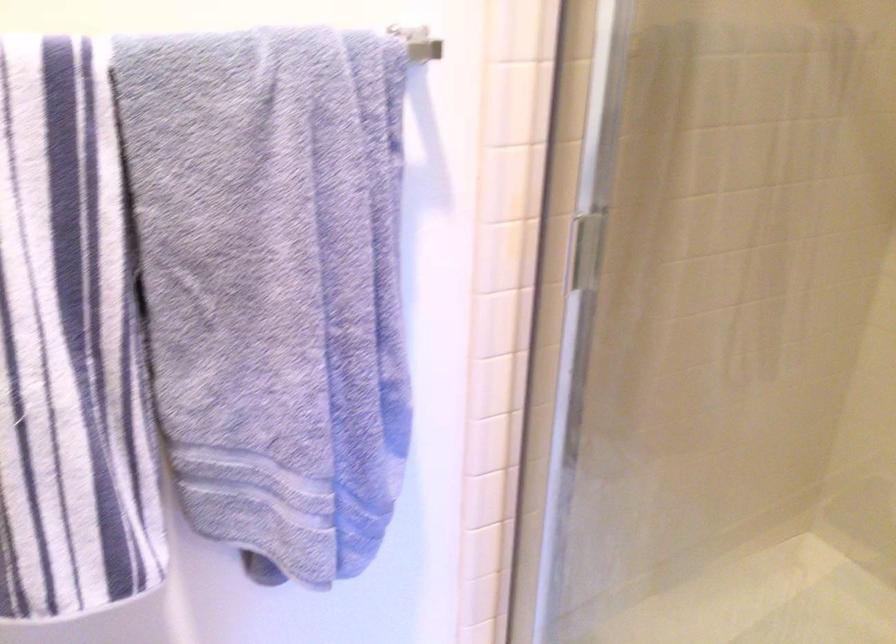
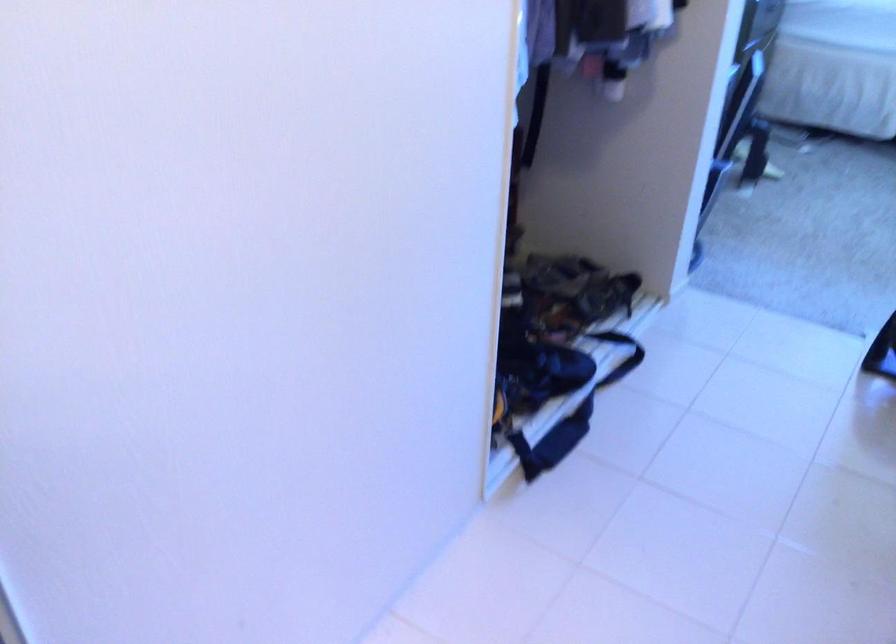
Looking at this image, how did the camera likely rotate?

The camera rotated toward right-down.